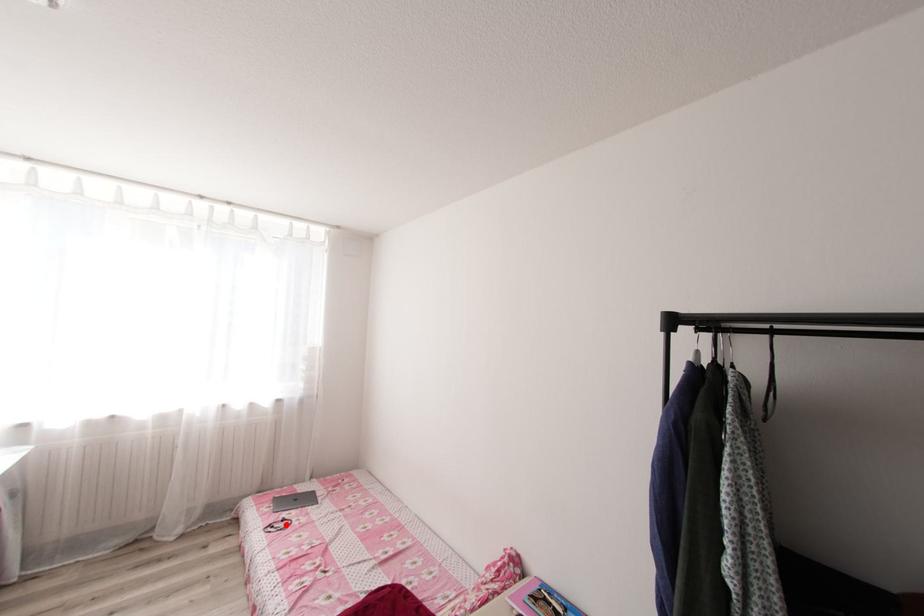
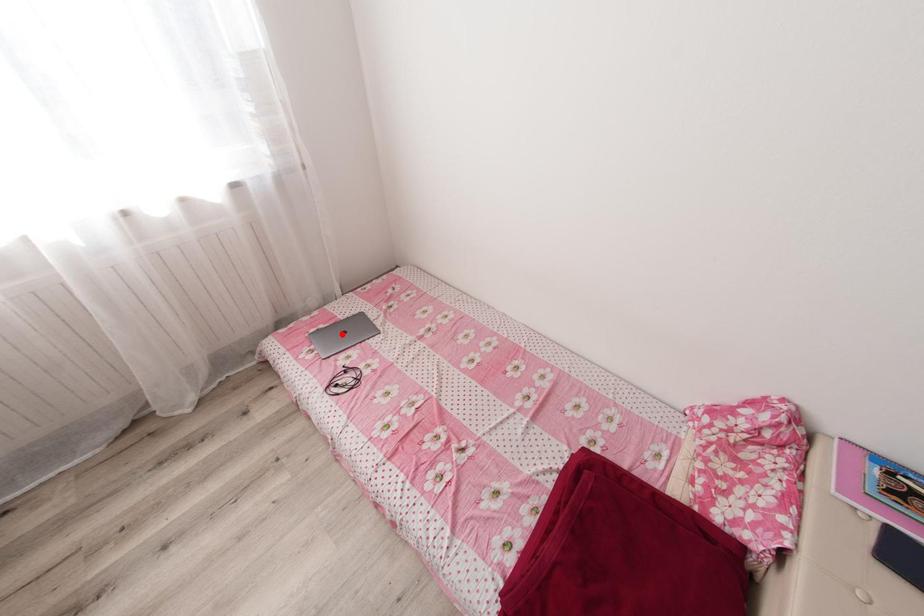
I am providing you with two images of the same scene from different viewpoints. A red point is marked on the first image and another point is marked on the second image. Is the red point in image1 aligned with the point shown in image2?

No